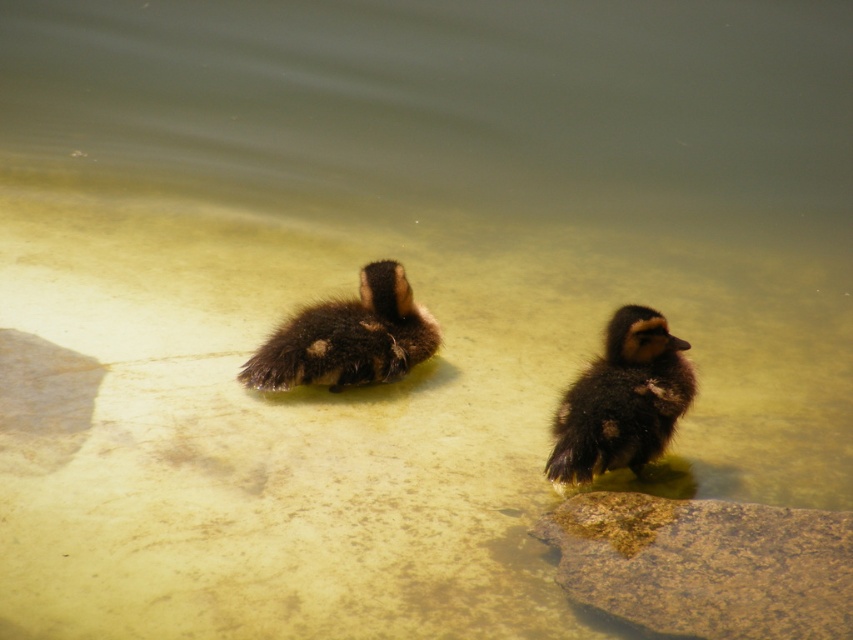
Question: Which object appears closest to the camera in this image?

Choices:
 (A) brown fuzzy duckling at center
 (B) brown textured rock at lower right
 (C) dark brown fluffy duckling at center

Answer: (B)

Question: Does dark brown fluffy duckling at center have a greater width compared to brown fuzzy duckling at center?

Choices:
 (A) yes
 (B) no

Answer: (B)

Question: Which point is closer to the camera?

Choices:
 (A) brown textured rock at lower right
 (B) dark brown fluffy duckling at center

Answer: (A)

Question: Is the position of dark brown fluffy duckling at center more distant than that of brown fuzzy duckling at center?

Choices:
 (A) yes
 (B) no

Answer: (B)

Question: Is dark brown fluffy duckling at center to the left of brown fuzzy duckling at center from the viewer's perspective?

Choices:
 (A) yes
 (B) no

Answer: (B)

Question: Which is nearer to the dark brown fluffy duckling at center?

Choices:
 (A) brown textured rock at lower right
 (B) brown fuzzy duckling at center

Answer: (A)